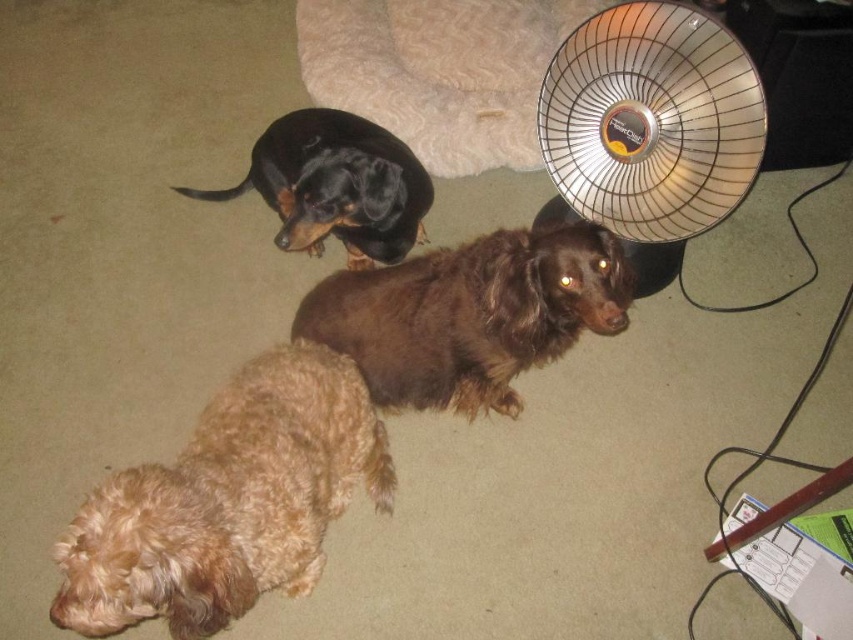
You are standing in front of the image and want to reach a point marked at coordinates point [268,461]. If your hand is 1.2 meters away from the camera, can you touch that point?

The distance of point [268,461] from camera is 1.35 meters. Since your hand is only 1.2 meters away from the camera, you cannot reach the point as it is farther away than your hand.

You are a dog owner who wants to place a new toy between the light brown fur at lower left and the beige plush dog bed at upper center. Based on their positions, where should you place the toy so it is equidistant from both objects?

The light brown fur at lower left is to the left of the beige plush dog bed at upper center. To place the toy equidistant between them, position it halfway between the two objects along the line connecting their centers.